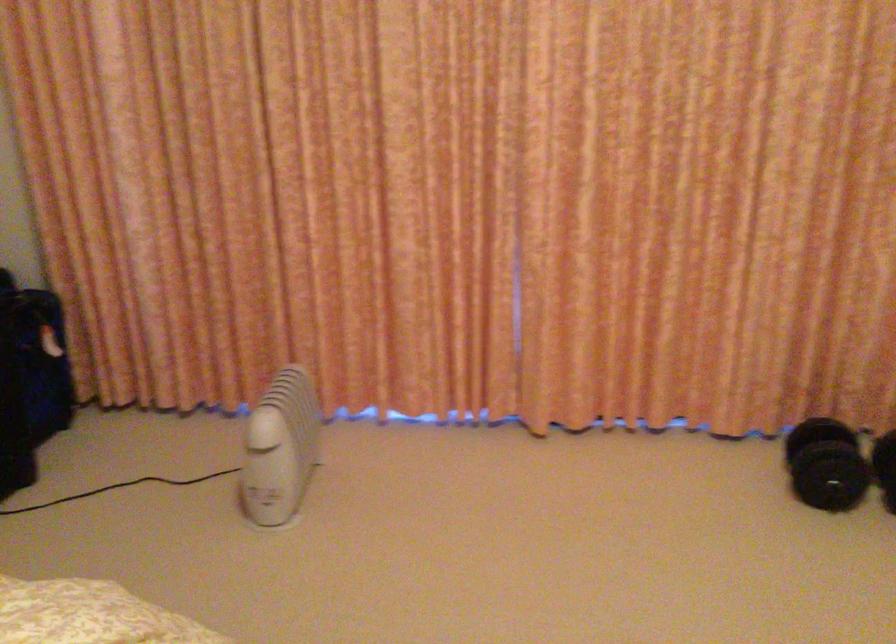
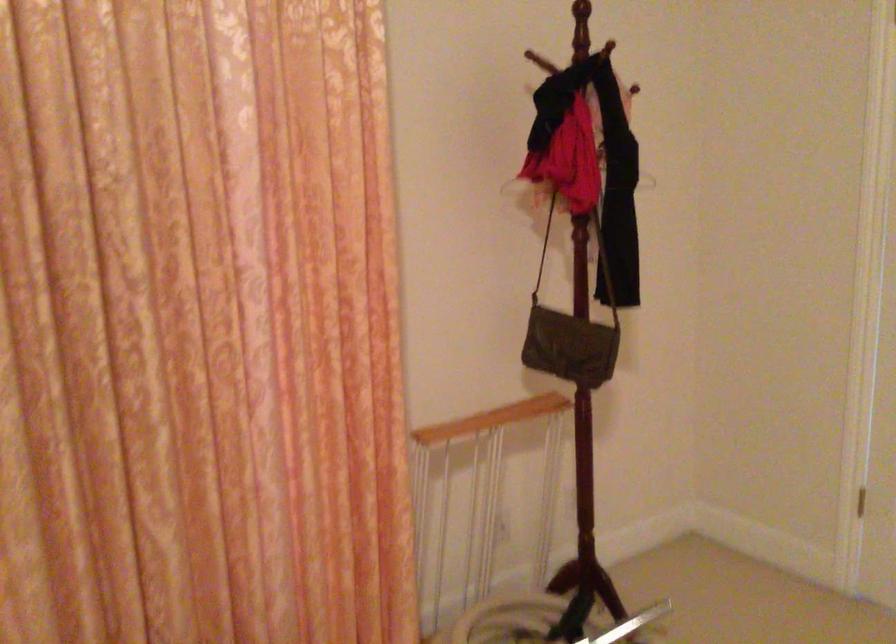
Question: The camera is either moving clockwise (left) or counter-clockwise (right) around the object. The first image is from the beginning of the video and the second image is from the end. Is the camera moving left or right when shooting the video?

Choices:
 (A) Left
 (B) Right

Answer: (A)